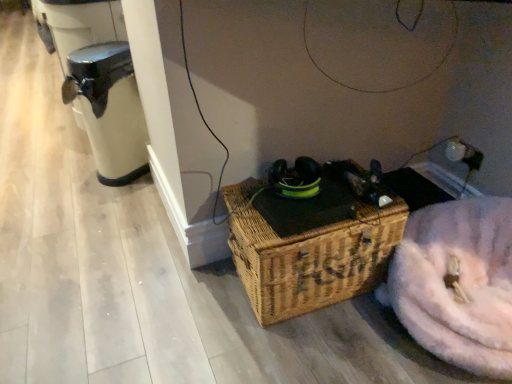
Question: Is woven brown picnic basket at center to the left of black plastic water heater at left from the viewer's perspective?

Choices:
 (A) no
 (B) yes

Answer: (A)

Question: From the image's perspective, would you say woven brown picnic basket at center is shown under black plastic water heater at left?

Choices:
 (A) no
 (B) yes

Answer: (B)

Question: Is woven brown picnic basket at center taller than black plastic water heater at left?

Choices:
 (A) yes
 (B) no

Answer: (B)

Question: From the image's perspective, is woven brown picnic basket at center on top of black plastic water heater at left?

Choices:
 (A) yes
 (B) no

Answer: (B)

Question: Considering the relative sizes of woven brown picnic basket at center and black plastic water heater at left in the image provided, is woven brown picnic basket at center wider than black plastic water heater at left?

Choices:
 (A) yes
 (B) no

Answer: (A)

Question: Can you confirm if woven brown picnic basket at center is smaller than black plastic water heater at left?

Choices:
 (A) no
 (B) yes

Answer: (A)

Question: Considering the relative positions of white fluffy washer at lower right and woven brown picnic basket at center in the image provided, is white fluffy washer at lower right behind woven brown picnic basket at center?

Choices:
 (A) no
 (B) yes

Answer: (A)

Question: Is white fluffy washer at lower right surrounding woven brown picnic basket at center?

Choices:
 (A) yes
 (B) no

Answer: (B)

Question: From the image's perspective, is white fluffy washer at lower right below woven brown picnic basket at center?

Choices:
 (A) yes
 (B) no

Answer: (A)

Question: Does white fluffy washer at lower right have a lesser width compared to woven brown picnic basket at center?

Choices:
 (A) no
 (B) yes

Answer: (A)

Question: Is white fluffy washer at lower right shorter than woven brown picnic basket at center?

Choices:
 (A) no
 (B) yes

Answer: (B)

Question: Is white fluffy washer at lower right to the left of woven brown picnic basket at center from the viewer's perspective?

Choices:
 (A) no
 (B) yes

Answer: (A)

Question: From a real-world perspective, is black plastic water heater at left positioned over white fluffy washer at lower right based on gravity?

Choices:
 (A) no
 (B) yes

Answer: (B)